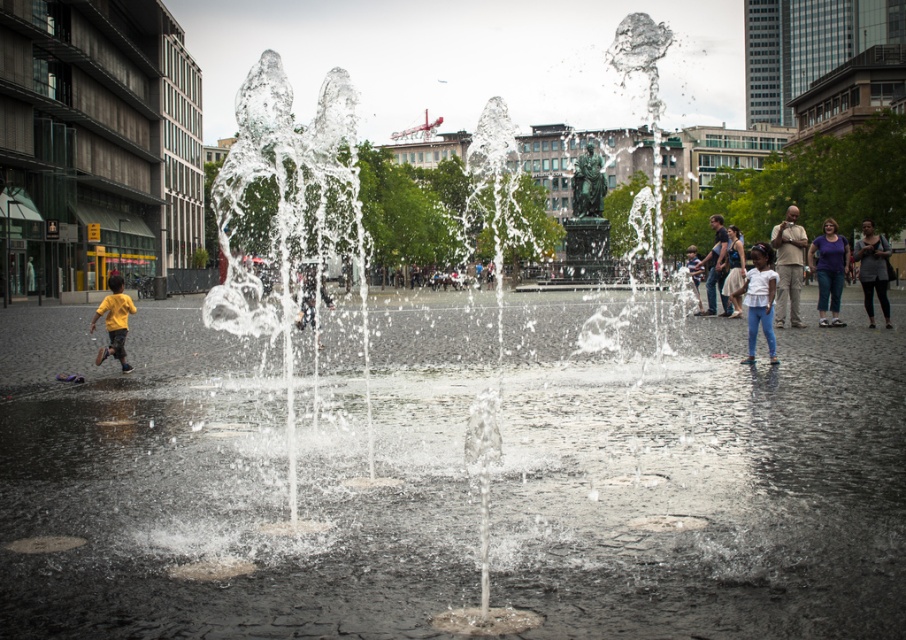
Is the position of dark gray fabric pants at right more distant than that of light blue jeans at center?

No, it is not.

How much distance is there between dark gray fabric pants at right and light blue jeans at center?

They are 4.19 meters apart.

The width and height of the screenshot is (906, 640). Describe the element at coordinates (872, 269) in the screenshot. I see `dark gray fabric pants at right` at that location.

Locate an element on the screen. The height and width of the screenshot is (640, 906). dark gray fabric pants at right is located at coordinates (872, 269).

Is tan khaki pants at right further to the viewer compared to white cotton shirt at lower right?

Yes, it is behind white cotton shirt at lower right.

Which is above, tan khaki pants at right or white cotton shirt at lower right?

Positioned higher is tan khaki pants at right.

Who is more forward, (791, 218) or (752, 362)?

Point (752, 362) is in front.

Locate an element on the screen. This screenshot has width=906, height=640. tan khaki pants at right is located at coordinates (788, 266).

Does white cotton shirt at lower right appear under yellow matte shirt at left?

Actually, white cotton shirt at lower right is above yellow matte shirt at left.

Does point (750, 289) come farther from viewer compared to point (122, 349)?

No.

Identify the location of white cotton shirt at lower right. (759, 300).